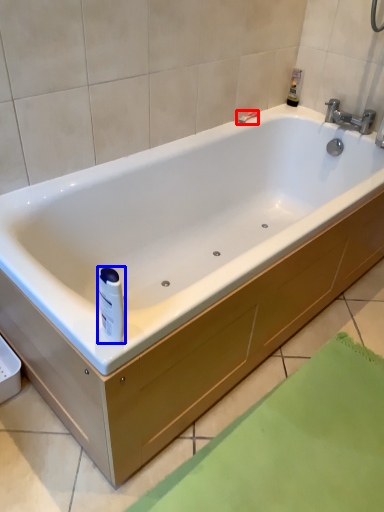
Question: Which point is closer to the camera, shower (highlighted by a red box) or toiletry (highlighted by a blue box)?

Choices:
 (A) shower
 (B) toiletry

Answer: (B)